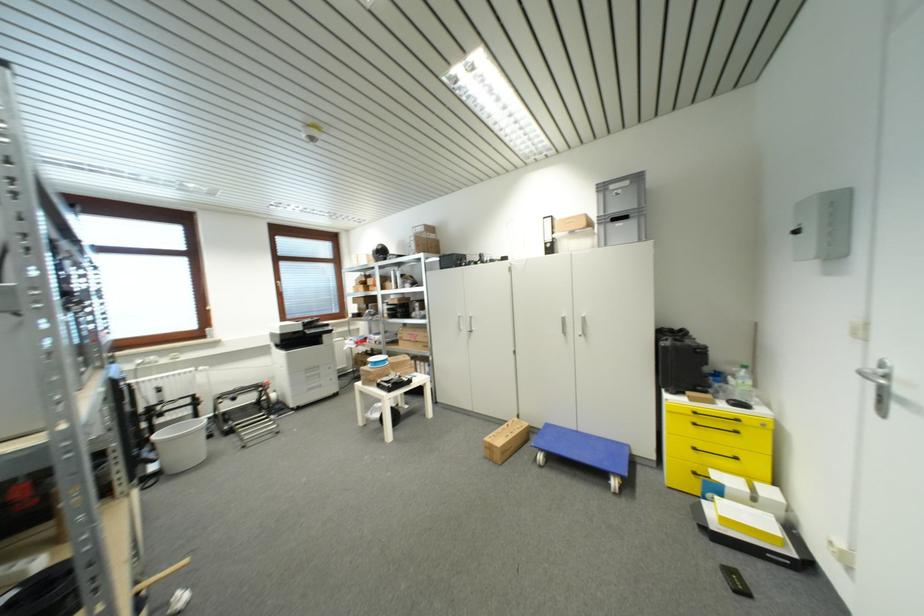
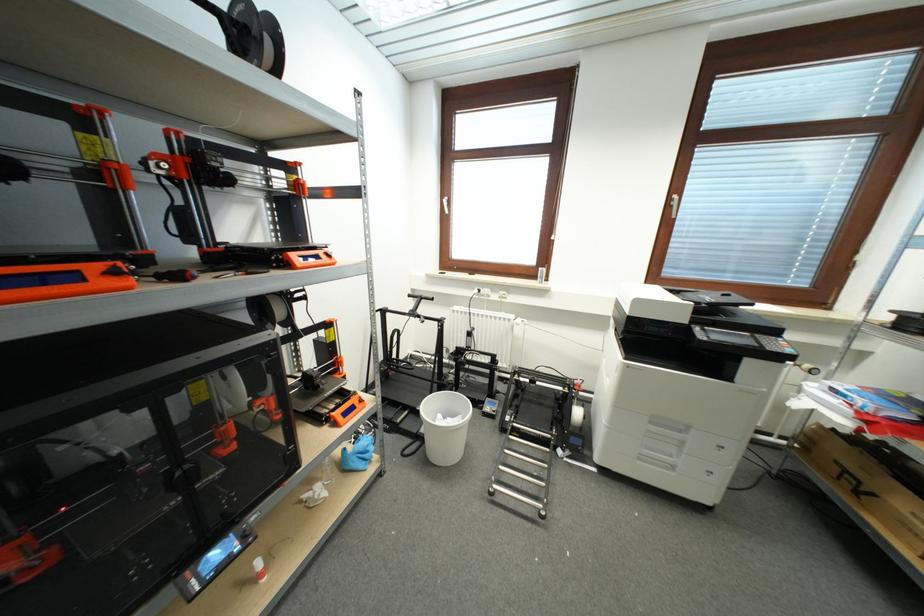
In the second image, find the point that corresponds to (238,400) in the first image.

(537, 384)